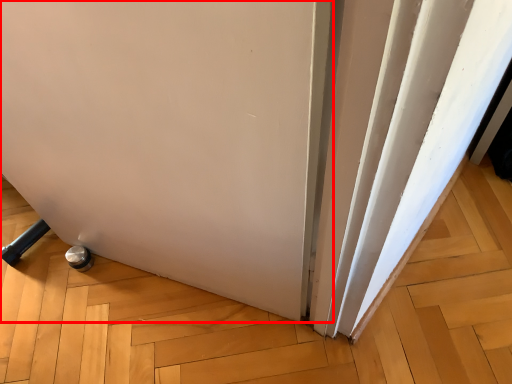
Question: From the image, what is the correct spatial relationship of door (annotated by the red box) in relation to curtain?

Choices:
 (A) left
 (B) right

Answer: (A)